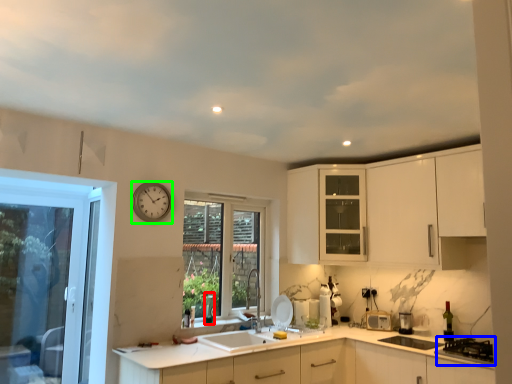
Question: Considering the real-world distances, which object is farthest from wine bottle (highlighted by a red box)? gas stove (highlighted by a blue box) or clock (highlighted by a green box)?

Choices:
 (A) gas stove
 (B) clock

Answer: (A)